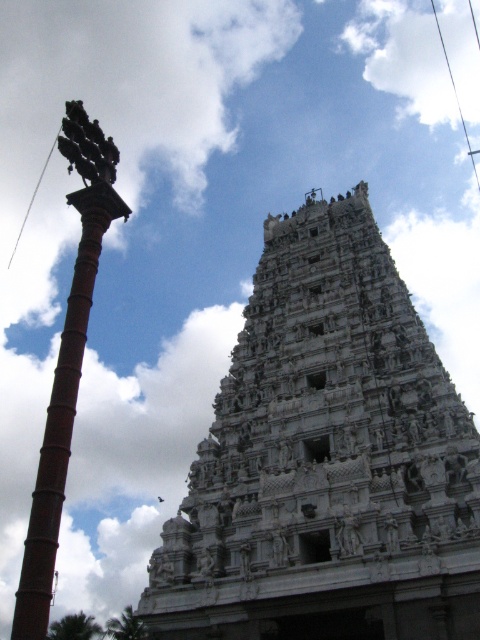
Does white stone temple at center have a greater height compared to brown brick pole at left?

Correct, white stone temple at center is much taller as brown brick pole at left.

Which is in front, point (423, 577) or point (45, 461)?

Positioned in front is point (45, 461).

This screenshot has height=640, width=480. Find the location of `white stone temple at center`. white stone temple at center is located at coordinates (326, 458).